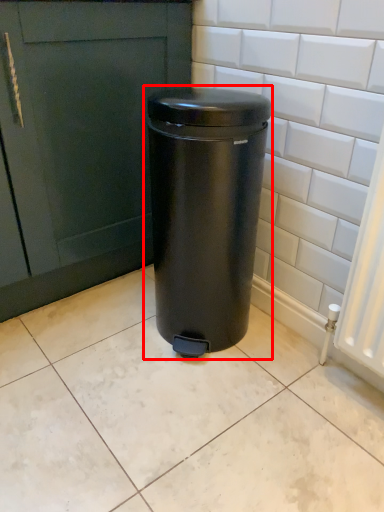
Question: From the image's perspective, where is waste container (annotated by the red box) located in relation to ceramic tile in the image?

Choices:
 (A) above
 (B) below

Answer: (A)